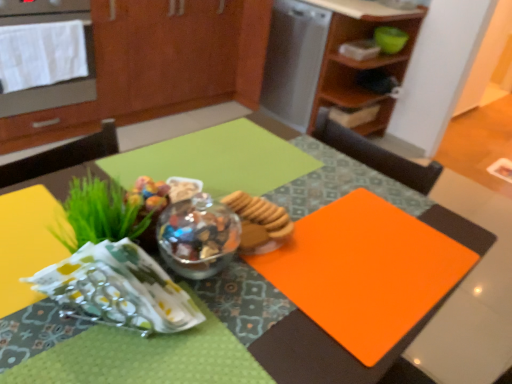
This screenshot has height=384, width=512. I want to click on free location above orange matte placemat at center (from a real-world perspective), so click(x=369, y=259).